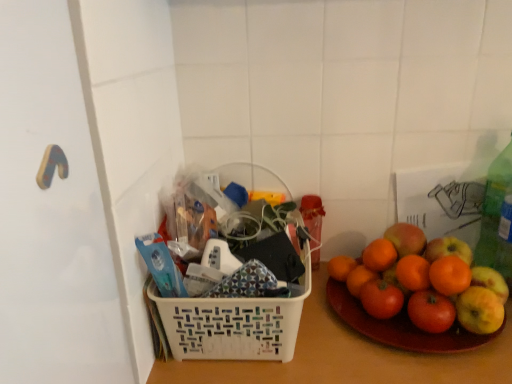
Question: Is white plastic basket at center to the left or to the right of smooth orange grapefruit at right in the image?

Choices:
 (A) left
 (B) right

Answer: (A)

Question: In terms of size, does white plastic basket at center appear bigger or smaller than smooth orange grapefruit at right?

Choices:
 (A) small
 (B) big

Answer: (B)

Question: Which is nearer to the smooth orange grapefruit at right?

Choices:
 (A) green plastic bottle at right
 (B) white plastic basket at center
 (C) white plastic basket at center

Answer: (C)

Question: Which of these objects is positioned farthest from the white plastic basket at center?

Choices:
 (A) smooth orange grapefruit at right
 (B) white plastic basket at center
 (C) green plastic bottle at right

Answer: (C)